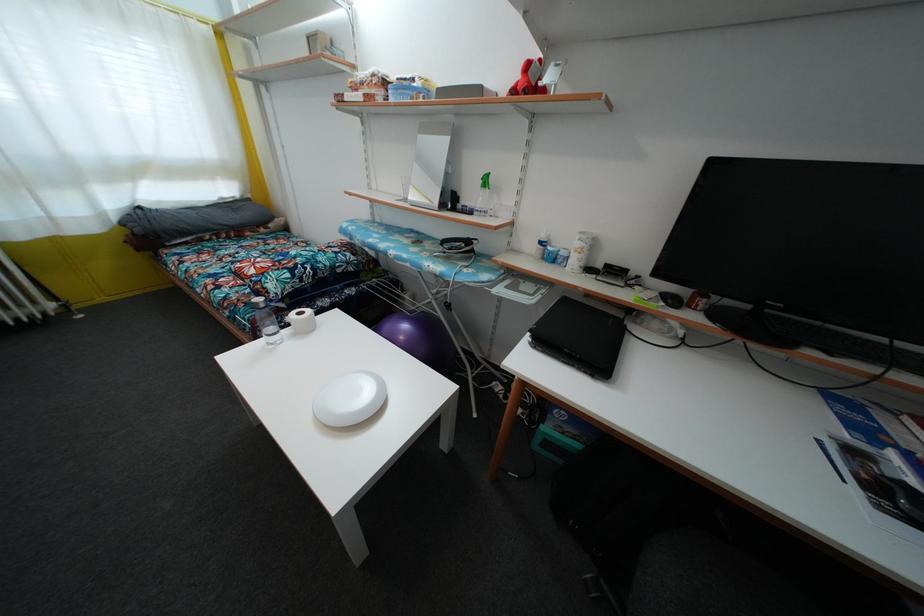
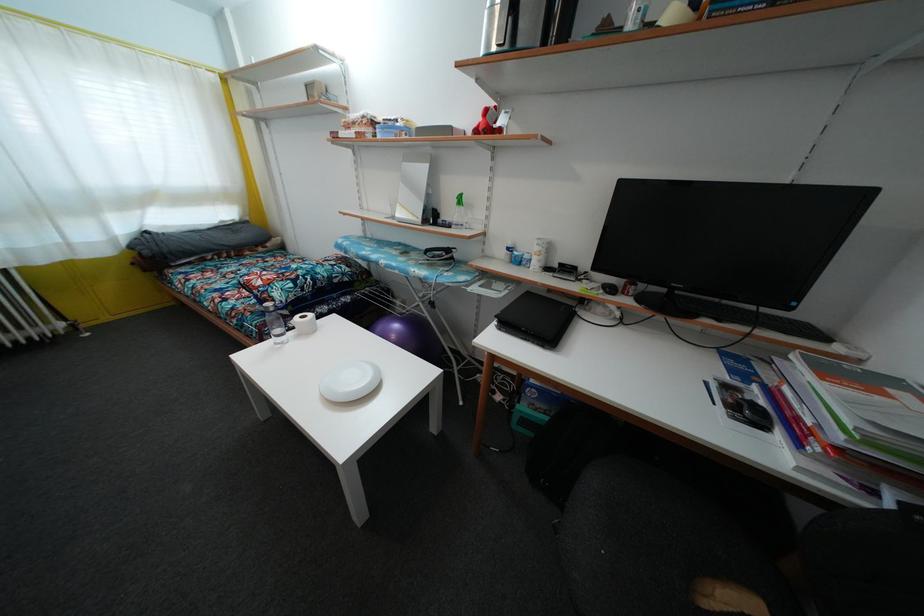
In the second image, find the point that corresponds to [304,320] in the first image.

(307, 323)